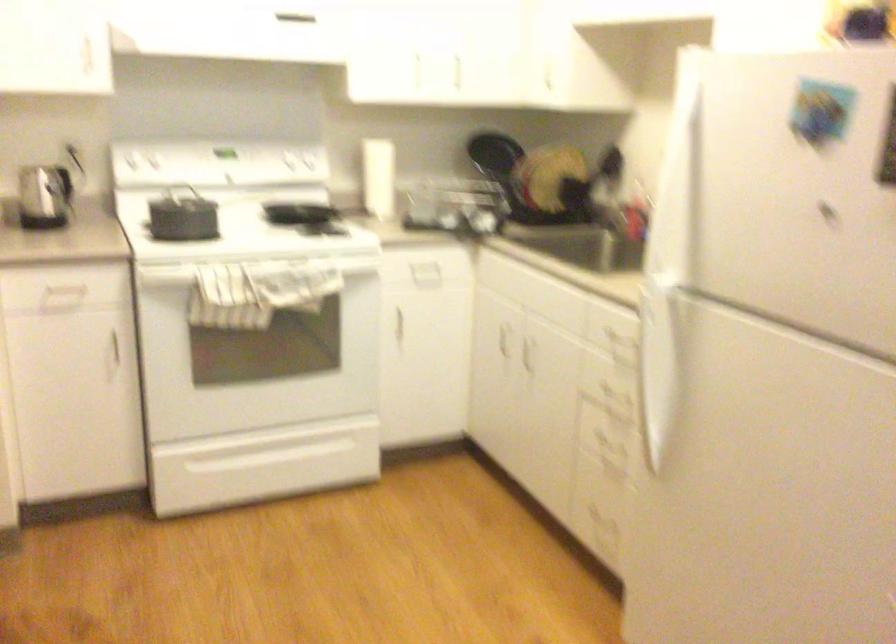
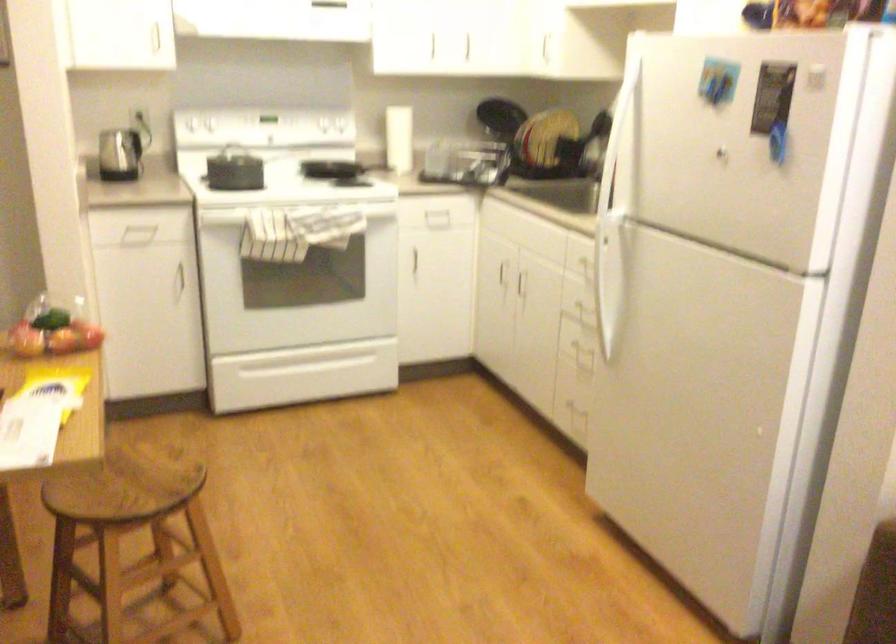
The point at [250,330] is marked in the first image. Where is the corresponding point in the second image?

(289, 261)